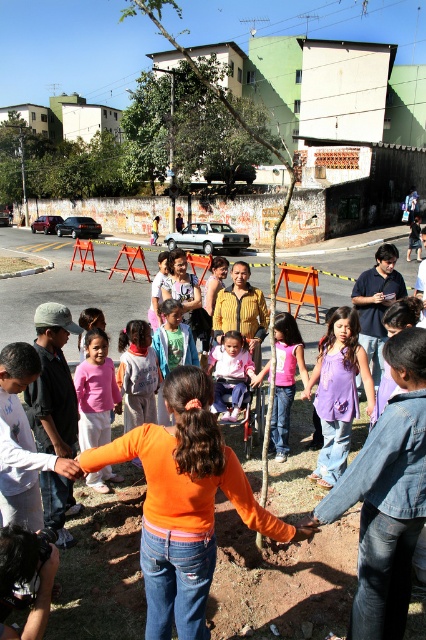
You are a photographer trying to capture the green leafy tree at upper center and the pink fabric shirt at center in the same frame. Based on their sizes, which object would appear bigger in your photo?

The green leafy tree at upper center would appear bigger in the photo because it has a larger size compared to the pink fabric shirt at center.

You are a photographer standing at the edge of the gathering. You want to capture a photo that includes both the green leafy tree at upper center and the pink fabric shirt at center. Considering the distance between them, can you fit both in your camera frame without moving closer or farther away?

The green leafy tree at upper center is 106.33 feet away from the pink fabric shirt at center. Since they are at different distances from the camera, it might be challenging to fit both in the frame without adjusting the camera position or zoom. However, if the camera has a wide enough angle, it could potentially capture both subjects.